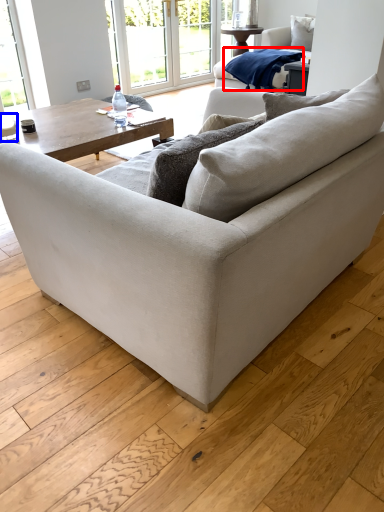
Question: Among these objects, which one is farthest to the camera, material (highlighted by a red box) or coffee cup (highlighted by a blue box)?

Choices:
 (A) material
 (B) coffee cup

Answer: (A)